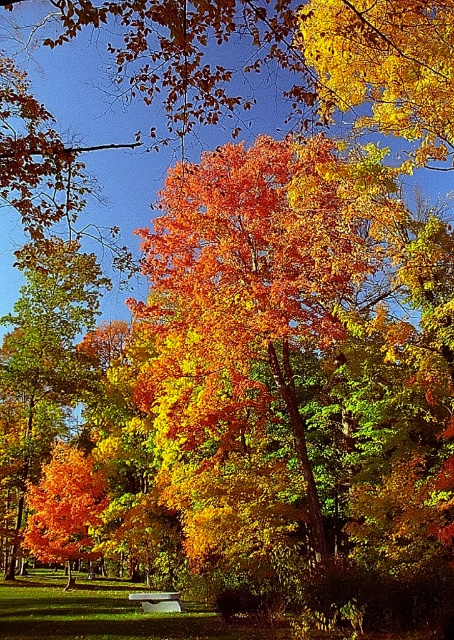
Question: Is shiny orange leaves at center thinner than white stone bench at center?

Choices:
 (A) no
 (B) yes

Answer: (A)

Question: Which point appears farthest from the camera in this image?

Choices:
 (A) (205, 460)
 (B) (133, 593)
 (C) (42, 246)

Answer: (B)

Question: Among these points, which one is nearest to the camera?

Choices:
 (A) (70, 412)
 (B) (181, 461)
 (C) (157, 598)

Answer: (C)

Question: From the image, what is the correct spatial relationship of shiny orange leaves at center in relation to shiny orange leaves at left?

Choices:
 (A) below
 (B) above

Answer: (B)

Question: Where is shiny orange leaves at center located in relation to white stone bench at center in the image?

Choices:
 (A) above
 (B) below

Answer: (A)

Question: Which point appears closest to the camera in this image?

Choices:
 (A) (39, 419)
 (B) (131, 600)

Answer: (B)